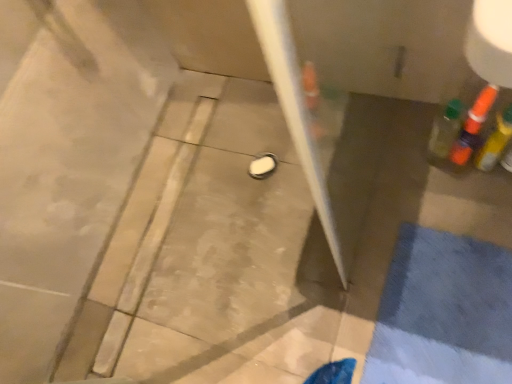
Question: Would you consider translucent orange bottle at upper right, placed as the 2th bottle when sorted from left to right, to be distant from translucent plastic bottle at right, which is counted as the first bottle, starting from the left?

Choices:
 (A) yes
 (B) no

Answer: (B)

Question: Is translucent orange bottle at upper right, the second bottle when ordered from right to left, bigger than translucent plastic bottle at right, which is counted as the first bottle, starting from the left?

Choices:
 (A) no
 (B) yes

Answer: (B)

Question: Can you confirm if translucent orange bottle at upper right, the second bottle when ordered from right to left, is wider than translucent plastic bottle at right, which is counted as the first bottle, starting from the left?

Choices:
 (A) no
 (B) yes

Answer: (B)

Question: Does translucent orange bottle at upper right, the second bottle when ordered from right to left, have a lesser height compared to translucent plastic bottle at right, which is counted as the first bottle, starting from the left?

Choices:
 (A) no
 (B) yes

Answer: (A)

Question: Is translucent plastic bottle at right, the third bottle positioned from the right, at the back of translucent orange bottle at upper right, placed as the 2th bottle when sorted from left to right?

Choices:
 (A) yes
 (B) no

Answer: (B)

Question: From the image's perspective, would you say translucent orange bottle at upper right, placed as the 2th bottle when sorted from left to right, is shown under translucent plastic bottle at right, which is counted as the first bottle, starting from the left?

Choices:
 (A) no
 (B) yes

Answer: (A)

Question: Is translucent orange bottle at right, arranged as the 3th bottle when viewed from the left, inside translucent plastic bottle at right, which is counted as the first bottle, starting from the left?

Choices:
 (A) yes
 (B) no

Answer: (B)

Question: Can you confirm if translucent plastic bottle at right, which is counted as the first bottle, starting from the left, is bigger than translucent orange bottle at right, which appears as the 1th bottle when viewed from the right?

Choices:
 (A) no
 (B) yes

Answer: (A)

Question: From the image's perspective, is translucent plastic bottle at right, which is counted as the first bottle, starting from the left, below translucent orange bottle at right, which appears as the 1th bottle when viewed from the right?

Choices:
 (A) no
 (B) yes

Answer: (A)

Question: Can you confirm if translucent plastic bottle at right, which is counted as the first bottle, starting from the left, is thinner than translucent orange bottle at right, arranged as the 3th bottle when viewed from the left?

Choices:
 (A) no
 (B) yes

Answer: (B)

Question: Is translucent plastic bottle at right, the third bottle positioned from the right, completely or partially outside of translucent orange bottle at right, which appears as the 1th bottle when viewed from the right?

Choices:
 (A) no
 (B) yes

Answer: (B)

Question: Does translucent plastic bottle at right, the third bottle positioned from the right, appear on the left side of translucent orange bottle at right, which appears as the 1th bottle when viewed from the right?

Choices:
 (A) yes
 (B) no

Answer: (A)

Question: Considering the relative sizes of translucent plastic bottle at right, the third bottle positioned from the right, and translucent orange bottle at upper right, the second bottle when ordered from right to left, in the image provided, is translucent plastic bottle at right, the third bottle positioned from the right, smaller than translucent orange bottle at upper right, the second bottle when ordered from right to left,?

Choices:
 (A) yes
 (B) no

Answer: (A)